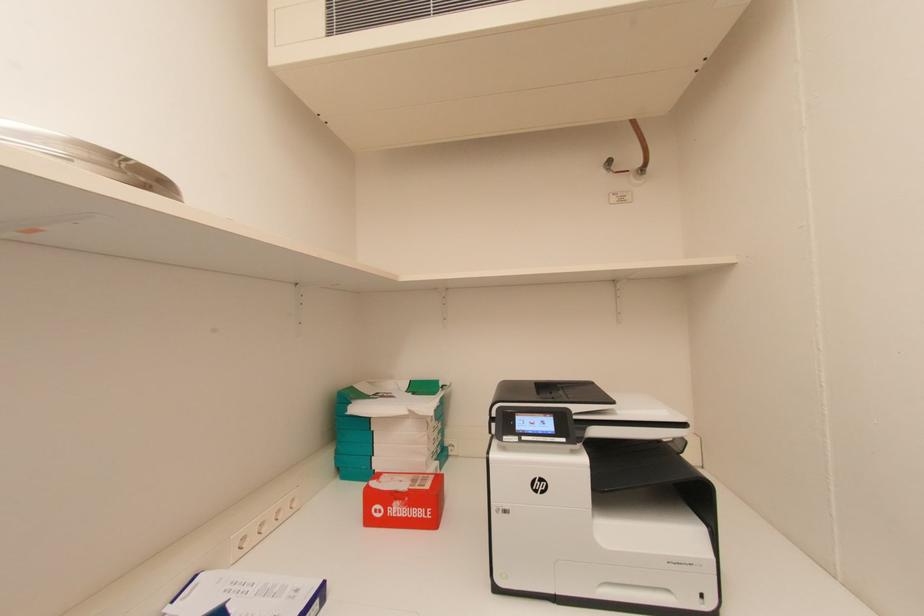
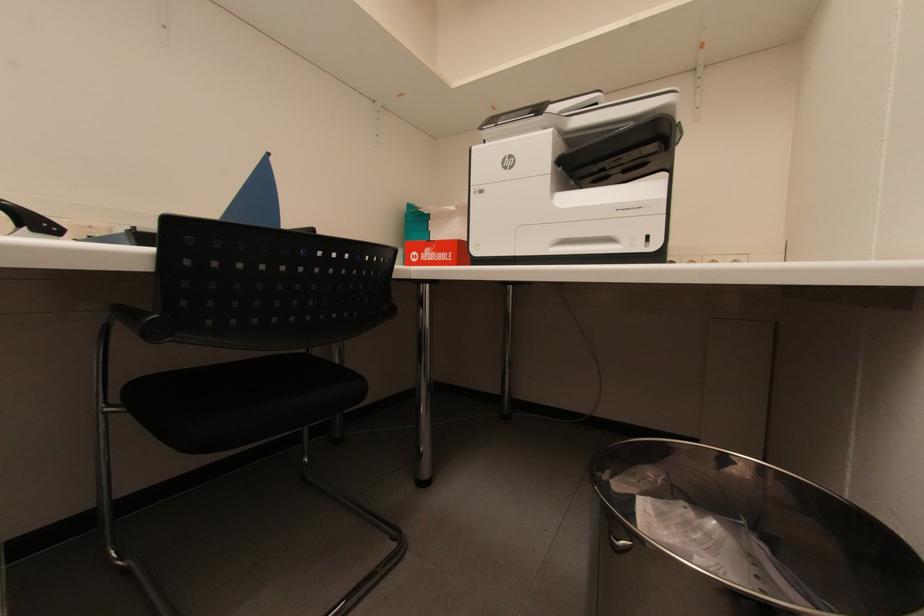
Question: The images are taken continuously from a first-person perspective. In which direction is your viewpoint rotating?

Choices:
 (A) Left
 (B) Right
 (C) Up
 (D) Down

Answer: (A)